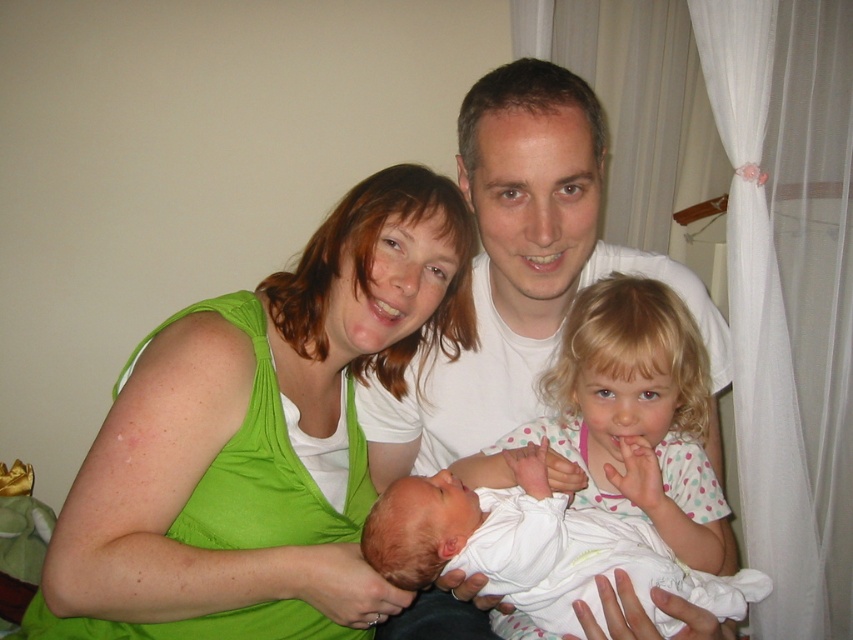
You are a photographer standing 1 meter away from the camera position. You want to take a closeup shot of the green fabric at center. Can you reach it with your hand without moving your body?

The green fabric at center is 87.40 centimeters from the camera. Since you are 1 meter away from the camera, the distance between you and the green fabric at center is approximately 187.40 centimeters. This distance is too far to reach with your hand without moving your body.

You are a photographer trying to capture a closeup of the white soft fabric newborn at center. You are currently focused on the white dotted shirt at center. What adjustment should you make to your camera to focus on the newborn?

You need to adjust your camera focus to move it further away from you since the white soft fabric newborn at center is behind the white dotted shirt at center.

You are a photographer trying to capture a closeup shot of both the white dotted shirt at center and the white soft fabric newborn at center. Since the camera can only focus on one subject at a time, which object should you choose to ensure the subject fills the frame appropriately?

The white dotted shirt at center is larger in size than the white soft fabric newborn at center, so choosing the white dotted shirt at center would allow it to fill the frame better when focusing on a single subject.